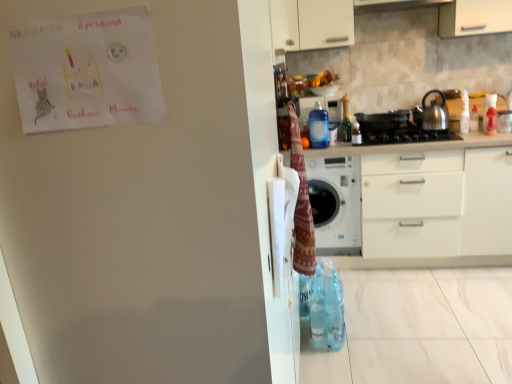
Question: Is translucent plastic bottle at upper right, marked as the third bottle in a right-to-left arrangement, looking in the opposite direction of satin black gas stove at center?

Choices:
 (A) no
 (B) yes

Answer: (A)

Question: Does translucent plastic bottle at upper right, which is the 2th bottle from left to right, turn towards satin black gas stove at center?

Choices:
 (A) yes
 (B) no

Answer: (B)

Question: Can you confirm if translucent plastic bottle at upper right, marked as the third bottle in a right-to-left arrangement, is shorter than satin black gas stove at center?

Choices:
 (A) no
 (B) yes

Answer: (A)

Question: Is translucent plastic bottle at upper right, marked as the third bottle in a right-to-left arrangement, at the left side of satin black gas stove at center?

Choices:
 (A) yes
 (B) no

Answer: (A)

Question: From the image's perspective, is translucent plastic bottle at upper right, marked as the third bottle in a right-to-left arrangement, below satin black gas stove at center?

Choices:
 (A) no
 (B) yes

Answer: (A)

Question: Is translucent plastic bottle at upper right, which is the 2th bottle from left to right, wider than satin black gas stove at center?

Choices:
 (A) yes
 (B) no

Answer: (B)

Question: Could knitted woolen blanket at upper right be considered to be inside satin silver kettle at right?

Choices:
 (A) no
 (B) yes

Answer: (A)

Question: Is satin silver kettle at right with knitted woolen blanket at upper right?

Choices:
 (A) yes
 (B) no

Answer: (B)

Question: Is satin silver kettle at right shorter than knitted woolen blanket at upper right?

Choices:
 (A) yes
 (B) no

Answer: (A)

Question: Does satin silver kettle at right have a lesser width compared to knitted woolen blanket at upper right?

Choices:
 (A) no
 (B) yes

Answer: (A)

Question: Are satin silver kettle at right and knitted woolen blanket at upper right located far from each other?

Choices:
 (A) no
 (B) yes

Answer: (B)

Question: Is satin silver kettle at right looking in the opposite direction of knitted woolen blanket at upper right?

Choices:
 (A) no
 (B) yes

Answer: (A)

Question: Considering the relative sizes of satin black gas stove at center and knitted woolen blanket at upper right in the image provided, is satin black gas stove at center wider than knitted woolen blanket at upper right?

Choices:
 (A) yes
 (B) no

Answer: (A)